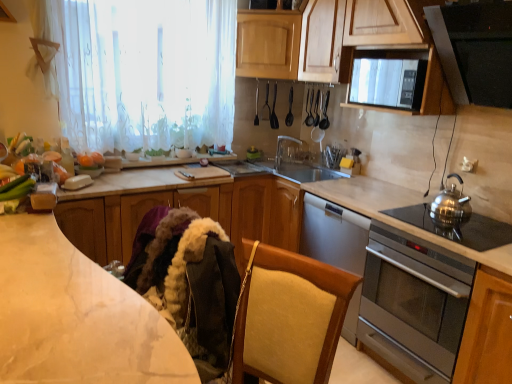
Image resolution: width=512 pixels, height=384 pixels. In order to click on free spot above marble at left, which is the second countertop in back-to-front order (from a real-world perspective) in this screenshot , I will do `click(50, 278)`.